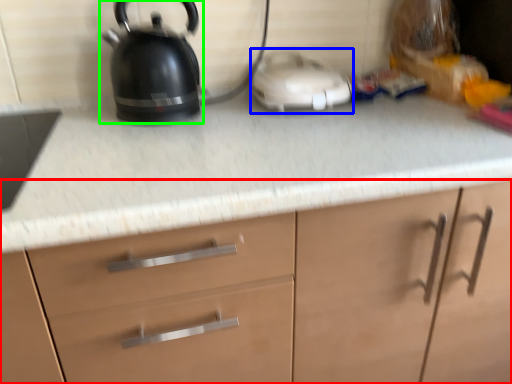
Question: Considering the real-world distances, which object is closest to cabinetry (highlighted by a red box)? appliance (highlighted by a blue box) or kettle (highlighted by a green box).

Choices:
 (A) appliance
 (B) kettle

Answer: (A)